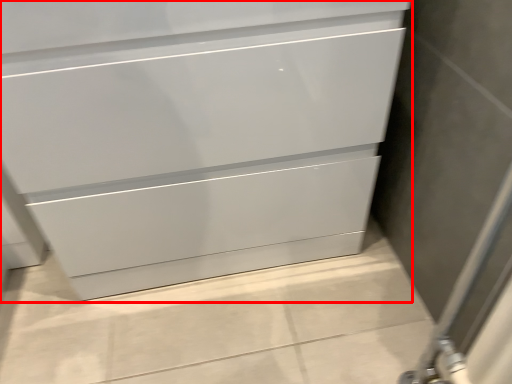
Question: From the image's perspective, considering the relative positions of chest of drawers (annotated by the red box) and screen door in the image provided, where is chest of drawers (annotated by the red box) located with respect to the staircase?

Choices:
 (A) above
 (B) below

Answer: (A)